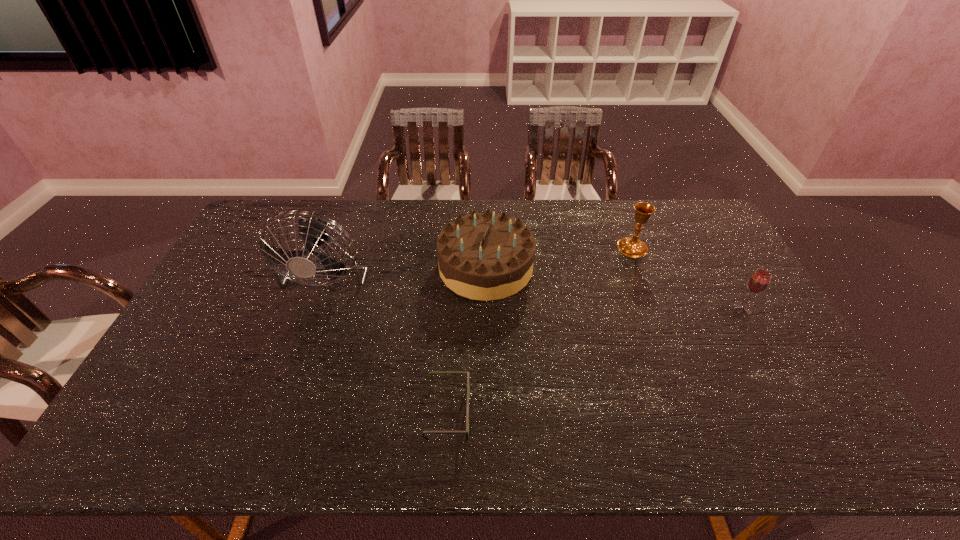
Where is `fan`? fan is located at coordinates (313, 230).

This screenshot has height=540, width=960. I want to click on the leftmost object, so click(x=313, y=230).

Identify the location of the second object from right to left. (632, 247).

Locate an element on the screen. This screenshot has height=540, width=960. birthday cake is located at coordinates (485, 256).

Where is `wineglass`? The width and height of the screenshot is (960, 540). wineglass is located at coordinates (759, 281).

Locate an element on the screen. This screenshot has width=960, height=540. the shortest object is located at coordinates (468, 373).

You are a GUI agent. You are given a task and a screenshot of the screen. Output one action in this format:
    pyautogui.click(x=<x>, y=<y>)
    Task: Click on the nearest object
    Image resolution: width=960 pixels, height=540 pixels.
    Given the screenshot: What is the action you would take?
    pyautogui.click(x=468, y=373)

The width and height of the screenshot is (960, 540). What are the coordinates of `vacant space located on the front-facing side of the leftmost object` in the screenshot? It's located at (278, 409).

Identify the location of free space located on the front of the second object from right to left. (655, 306).

Find the location of a particular element. This screenshot has width=960, height=540. vacant space situated on the front-facing side of the birthday cake is located at coordinates (348, 267).